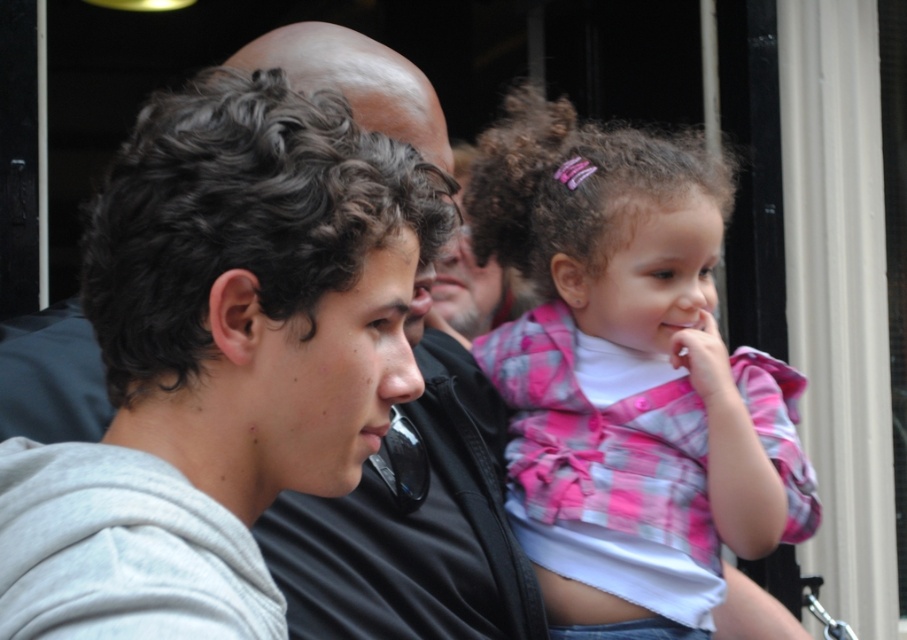
Question: Is the position of pink plaid shirt at center less distant than that of gray hoodie at center?

Choices:
 (A) yes
 (B) no

Answer: (B)

Question: Is pink plaid shirt at center to the left of gray hoodie at center from the viewer's perspective?

Choices:
 (A) no
 (B) yes

Answer: (A)

Question: Which point is farther to the camera?

Choices:
 (A) gray hoodie at center
 (B) pink plaid shirt at center

Answer: (B)

Question: Which point is closer to the camera?

Choices:
 (A) (522, 589)
 (B) (478, 340)

Answer: (A)

Question: Is pink plaid shirt at center thinner than gray hoodie at center?

Choices:
 (A) no
 (B) yes

Answer: (A)